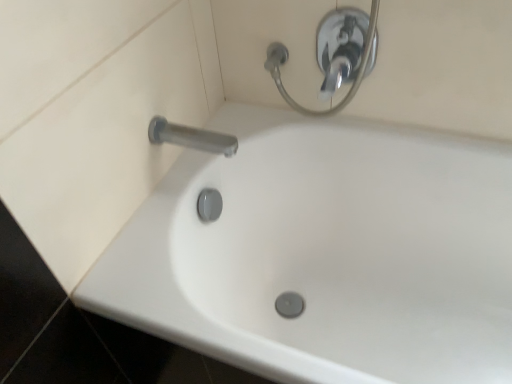
Question: From their relative heights in the image, would you say chrome metallic shower handle at upper center is taller or shorter than satin nickel faucet at upper left?

Choices:
 (A) short
 (B) tall

Answer: (B)

Question: From a real-world perspective, is chrome metallic shower handle at upper center above or below satin nickel faucet at upper left?

Choices:
 (A) below
 (B) above

Answer: (B)

Question: Estimate the real-world distances between objects in this image. Which object is farther from the white glossy bathtub at center?

Choices:
 (A) satin nickel faucet at upper left
 (B) chrome metallic shower handle at upper center

Answer: (A)

Question: Which object is the farthest from the chrome metallic shower handle at upper center?

Choices:
 (A) satin nickel faucet at upper left
 (B) white glossy bathtub at center

Answer: (B)